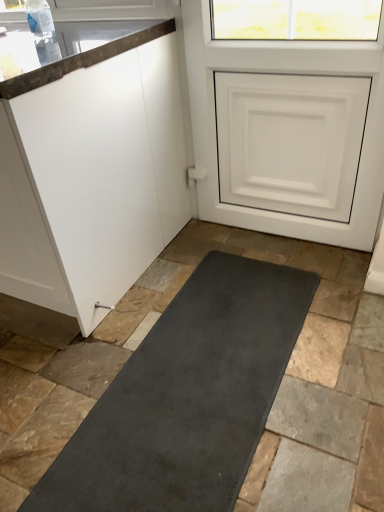
Question: From the image's perspective, is white matte door at upper right above or below white matte cabinet at left?

Choices:
 (A) below
 (B) above

Answer: (B)

Question: From a real-world perspective, relative to white matte cabinet at left, is white matte door at upper right vertically above or below?

Choices:
 (A) above
 (B) below

Answer: (A)

Question: Is white matte door at upper right in front of or behind white matte cabinet at left in the image?

Choices:
 (A) front
 (B) behind

Answer: (B)

Question: Is white matte cabinet at left situated inside white matte door at upper right or outside?

Choices:
 (A) outside
 (B) inside

Answer: (A)

Question: Does point 51,183 appear closer or farther from the camera than point 264,222?

Choices:
 (A) farther
 (B) closer

Answer: (B)

Question: Looking at the image, does white matte cabinet at left seem bigger or smaller compared to white matte door at upper right?

Choices:
 (A) big
 (B) small

Answer: (A)

Question: From a real-world perspective, is white matte cabinet at left positioned above or below white matte door at upper right?

Choices:
 (A) below
 (B) above

Answer: (A)